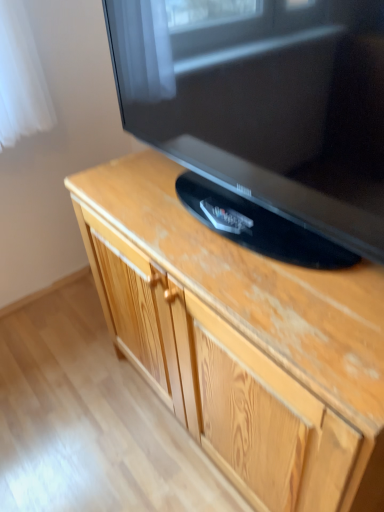
Where is `wooden cabinet at center`? Image resolution: width=384 pixels, height=512 pixels. wooden cabinet at center is located at coordinates (x=242, y=342).

Describe the element at coordinates (242, 342) in the screenshot. I see `wooden cabinet at center` at that location.

What is the approximate width of wooden cabinet at center?

56.64 centimeters.

Locate an element on the screen. The image size is (384, 512). matte black television at upper center is located at coordinates (263, 114).

Image resolution: width=384 pixels, height=512 pixels. Describe the element at coordinates (263, 114) in the screenshot. I see `matte black television at upper center` at that location.

Locate an element on the screen. This screenshot has width=384, height=512. wooden cabinet at center is located at coordinates (242, 342).

Is wooden cabinet at center to the left or to the right of matte black television at upper center in the image?

wooden cabinet at center is positioned on matte black television at upper center's right side.

Which object is more forward, wooden cabinet at center or matte black television at upper center?

matte black television at upper center is more forward.

Does point (131, 270) appear closer or farther from the camera than point (378, 9)?

Point (131, 270) is positioned farther from the camera compared to point (378, 9).

From the image's perspective, who appears lower, wooden cabinet at center or matte black television at upper center?

From the image's view, wooden cabinet at center is below.

From a real-world perspective, which object rests below the other?

wooden cabinet at center, from a real-world perspective.

Can you confirm if wooden cabinet at center is thinner than matte black television at upper center?

No.

Is wooden cabinet at center taller than matte black television at upper center?

Correct, wooden cabinet at center is much taller as matte black television at upper center.

Considering the sizes of objects wooden cabinet at center and matte black television at upper center in the image provided, who is smaller, wooden cabinet at center or matte black television at upper center?

matte black television at upper center.

Is wooden cabinet at center positioned beyond the bounds of matte black television at upper center?

Yes, wooden cabinet at center is located beyond the bounds of matte black television at upper center.

Would you consider wooden cabinet at center to be distant from matte black television at upper center?

No, there isn't a large distance between wooden cabinet at center and matte black television at upper center.

Is wooden cabinet at center oriented towards matte black television at upper center?

No.

How much distance is there between wooden cabinet at center and matte black television at upper center?

wooden cabinet at center is 10.31 inches from matte black television at upper center.

Locate an element on the screen. The height and width of the screenshot is (512, 384). television that is in front of the wooden cabinet at center is located at coordinates (263, 114).

In the image, is matte black television at upper center on the left side or the right side of wooden cabinet at center?

Clearly, matte black television at upper center is on the left of wooden cabinet at center in the image.

In the scene shown: Which is behind, matte black television at upper center or wooden cabinet at center?

wooden cabinet at center.

Which point is more distant from viewer, (364, 250) or (216, 339)?

The point (216, 339) is farther.

From the image's perspective, which object appears higher, matte black television at upper center or wooden cabinet at center?

From the image's view, matte black television at upper center is above.

From a real-world perspective, which object stands above the other?

From a 3D spatial view, matte black television at upper center is above.

Is matte black television at upper center wider than wooden cabinet at center?

No.

Who is shorter, matte black television at upper center or wooden cabinet at center?

Standing shorter between the two is matte black television at upper center.

Considering the sizes of matte black television at upper center and wooden cabinet at center in the image, is matte black television at upper center bigger or smaller than wooden cabinet at center?

Clearly, matte black television at upper center is smaller in size than wooden cabinet at center.

Is matte black television at upper center located outside wooden cabinet at center?

Yes, matte black television at upper center is located beyond the bounds of wooden cabinet at center.

Is there a large distance between matte black television at upper center and wooden cabinet at center?

matte black television at upper center is near wooden cabinet at center, not far away.

Is wooden cabinet at center at the back of matte black television at upper center?

No.

What are the coordinates of `cabinetry lying on the right of matte black television at upper center` in the screenshot? It's located at (242, 342).

Where is `cabinetry beneath the matte black television at upper center (from a real-world perspective)`? Image resolution: width=384 pixels, height=512 pixels. cabinetry beneath the matte black television at upper center (from a real-world perspective) is located at coordinates (242, 342).

There is a wooden cabinet at center. Find the location of `television above it (from a real-world perspective)`. television above it (from a real-world perspective) is located at coordinates (263, 114).